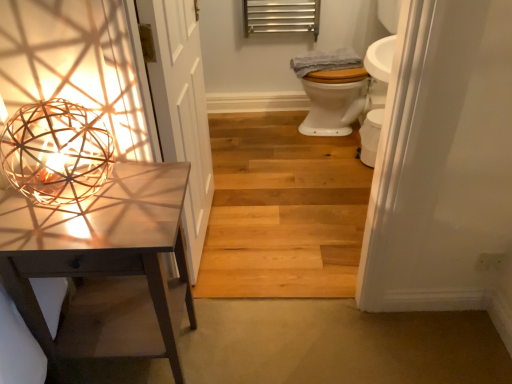
Question: From the image's perspective, would you say white wood door at left is shown under matte white table at left?

Choices:
 (A) no
 (B) yes

Answer: (A)

Question: Is white wood door at left next to matte white table at left and touching it?

Choices:
 (A) yes
 (B) no

Answer: (B)

Question: Would you say white wood door at left contains matte white table at left?

Choices:
 (A) yes
 (B) no

Answer: (B)

Question: Does white wood door at left have a lesser height compared to matte white table at left?

Choices:
 (A) yes
 (B) no

Answer: (B)

Question: Is white wood door at left oriented towards matte white table at left?

Choices:
 (A) yes
 (B) no

Answer: (B)

Question: Is the depth of white wood door at left greater than that of matte white table at left?

Choices:
 (A) yes
 (B) no

Answer: (A)

Question: Is the position of matte white table at left less distant than that of white glossy toilet bowl at center?

Choices:
 (A) no
 (B) yes

Answer: (B)

Question: Is matte white table at left taller than white glossy toilet bowl at center?

Choices:
 (A) yes
 (B) no

Answer: (A)

Question: Are matte white table at left and white glossy toilet bowl at center making contact?

Choices:
 (A) yes
 (B) no

Answer: (B)

Question: Is matte white table at left further to the viewer compared to white glossy toilet bowl at center?

Choices:
 (A) yes
 (B) no

Answer: (B)

Question: Can you confirm if matte white table at left is positioned to the right of white glossy toilet bowl at center?

Choices:
 (A) yes
 (B) no

Answer: (B)

Question: Is matte white table at left oriented towards white glossy toilet bowl at center?

Choices:
 (A) yes
 (B) no

Answer: (B)

Question: From the image's perspective, is white wood door at left on metallic silver radiator at upper center?

Choices:
 (A) no
 (B) yes

Answer: (A)